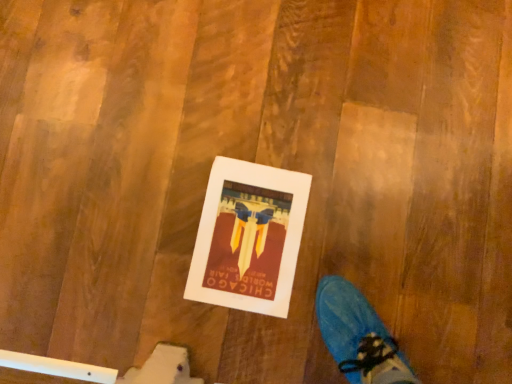
Locate an element on the screen. vacant location below matte paper postcard at center (from a real-world perspective) is located at coordinates (251, 237).